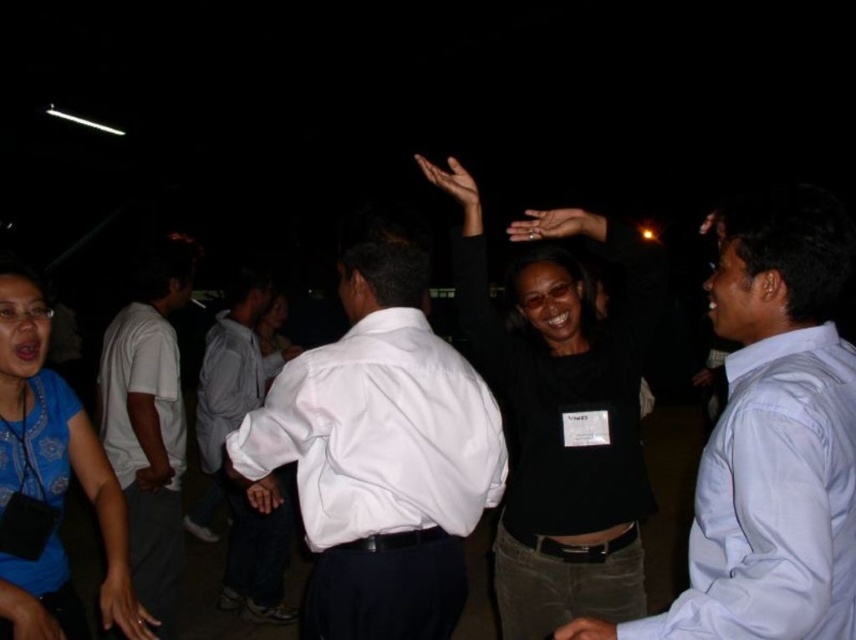
You are at a party and want to take a photo of the white smooth shirt at center and the brown matte hand at upper center. Which object should you focus on first if you want to capture both in the same frame without moving the camera?

The white smooth shirt at center has a smaller size compared to brown matte hand at upper center, so you should focus on the brown matte hand at upper center first to ensure both are in focus.

You are a photographer at the event and want to capture a photo of both the white smooth shirt at center and the brown matte hand at upper center without any obstruction. Based on their sizes in the image, which object should you focus on first to ensure they both fit in the frame?

The white smooth shirt at center is much taller than the brown matte hand at upper center, so you should focus on the larger object first to ensure both fit in the frame.

Looking at the two hands in the image, the brown matte hand at upper center and the smooth skin hand at center, which one is positioned to the left of the other?

The brown matte hand at upper center is positioned to the left of the smooth skin hand at center.